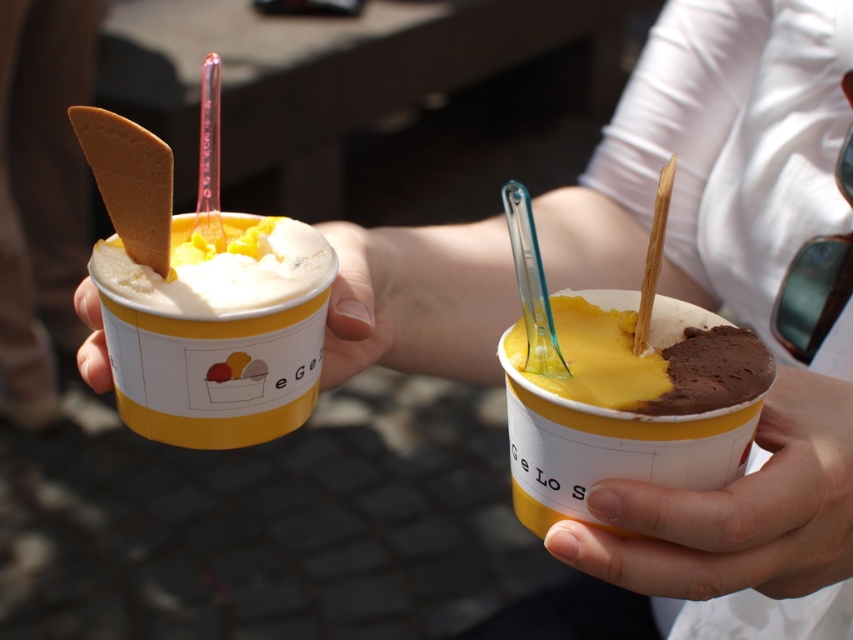
You are at an ice cream shop and have two cups in front of you. You want to choose the larger one to get more gelato. Which cup should you pick between the smooth yellow ice cream cup at center and the yellow matte ice cream cup at left?

The smooth yellow ice cream cup at center is larger than the yellow matte ice cream cup at left, so you should pick the smooth yellow ice cream cup at center to get more gelato.

You are trying to grab the smooth yellow ice cream cup at center with your right hand. Based on the image, will your hand reach the cup before the smooth skin hand at lower right?

The smooth yellow ice cream cup at center is further to the viewer than the smooth skin hand at lower right, so your hand will reach the cup before the smooth skin hand at lower right.